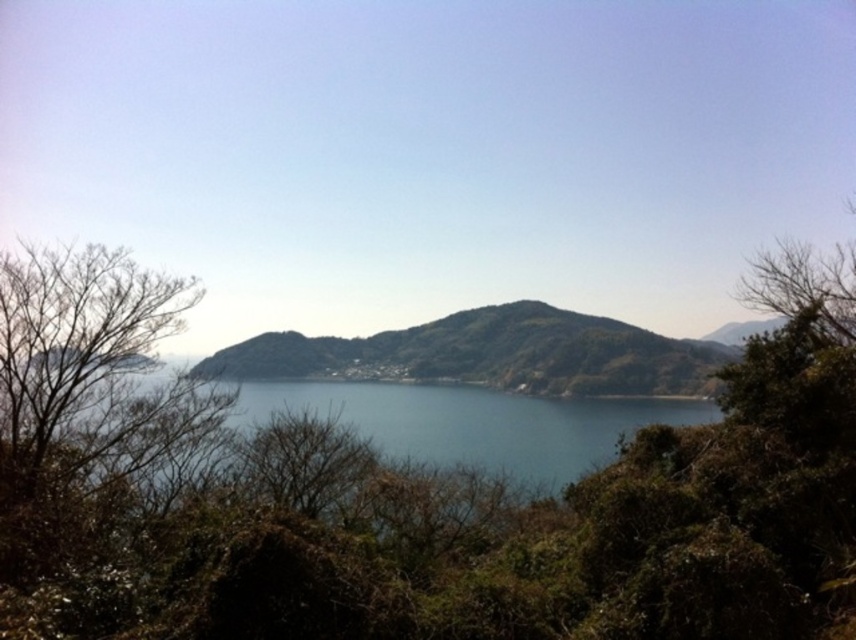
You are standing at the edge of the water in the image and want to reach the green leafy tree at center. Which direction should you walk to avoid the green grassy hill at center?

The green leafy tree at center is above the green grassy hill at center, so you should walk forward towards the tree without needing to avoid the hill since the tree is positioned higher up.

You are a hiker standing at the edge of the lake looking towards the center of the image. Which object, the green leafy tree at center or the green grassy hill at center, would appear taller to you?

The green leafy tree at center appears taller than the green grassy hill at center.

In the scene shown: You are an artist planning to paint the scene. You want to ensure the green leafy tree at center and the green grassy hill at center are proportionally accurate. Which object should you make smaller in your painting?

The green leafy tree at center should be made smaller because it occupies less space than the green grassy hill at center according to the description.